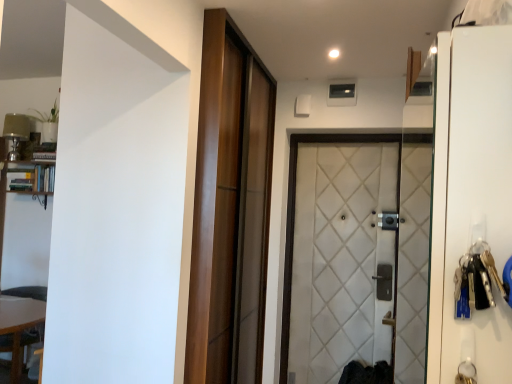
Question: Would you say white quilted fabric door at center, the 1th door viewed from the right, is inside or outside wooden table at lower left?

Choices:
 (A) inside
 (B) outside

Answer: (B)

Question: Considering the positions of white quilted fabric door at center, the 1th door viewed from the right, and wooden table at lower left in the image, is white quilted fabric door at center, the 1th door viewed from the right, taller or shorter than wooden table at lower left?

Choices:
 (A) tall
 (B) short

Answer: (A)

Question: Considering the real-world distances, which object is farthest from the white glossy screen door at right?

Choices:
 (A) white quilted fabric door at center, the 1th door viewed from the right
 (B) wooden table at lower left
 (C) wooden sliding door at center, the first door positioned from the left
 (D) wooden bookshelf at left

Answer: (D)

Question: Considering the real-world distances, which object is farthest from the wooden table at lower left?

Choices:
 (A) white quilted fabric door at center, arranged as the 2th door when viewed from the left
 (B) white glossy screen door at right
 (C) wooden sliding door at center, the first door positioned from the left
 (D) wooden bookshelf at left

Answer: (B)